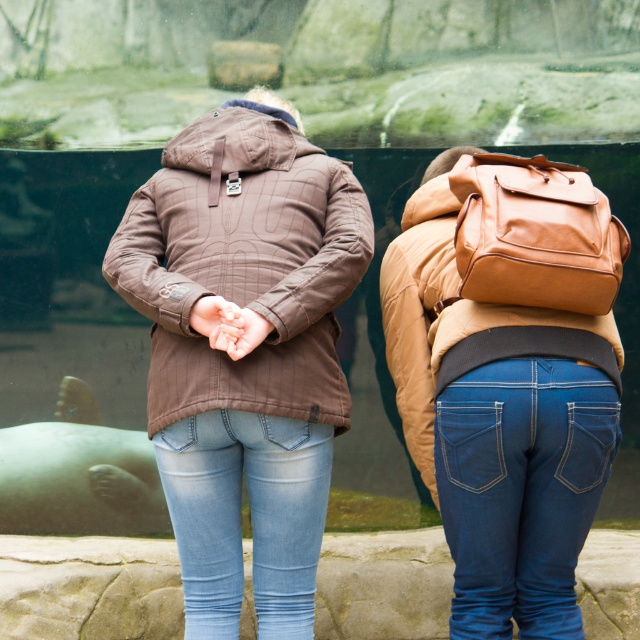
You are standing in a zoo and want to take a photo of the brown quilted jacket at center without getting too close. If your camera has a zoom lens with a maximum focal length of 200mm, what is the minimum distance you need to maintain to capture the entire jacket in the frame?

The brown quilted jacket at center and viewer are 4.37 meters apart. To capture the entire jacket in the frame with a 200mm lens, you need to maintain a distance of at least 4.37 meters.